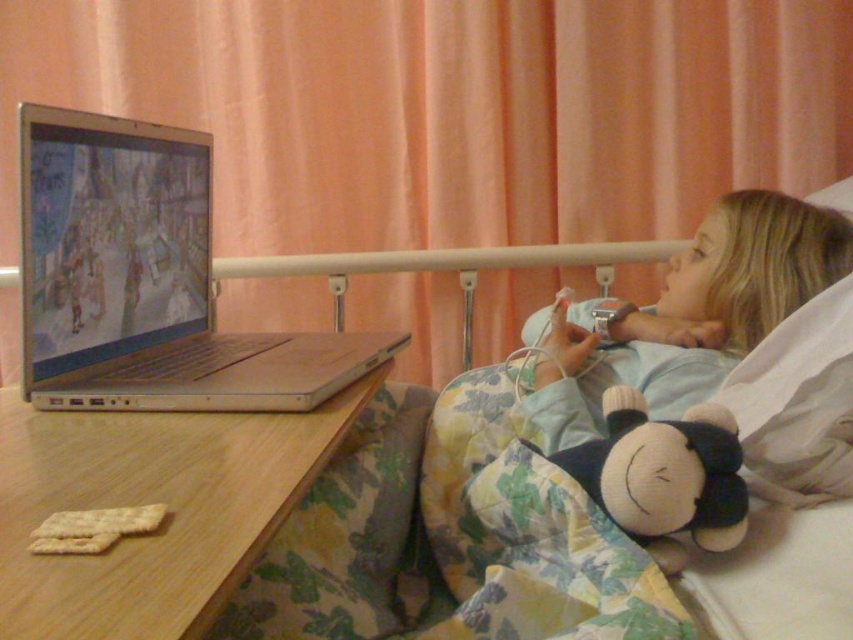
You are a nurse entering the room and need to check the child. The fluffy fabric bed at center is in the way of the door. Can you walk around it to reach the child?

The fluffy fabric bed at center is located at point (450, 536), so yes, you can walk around it to reach the child.

You are a nurse entering the room and need to check the child. To do so, you must approach the bed and the monkey. Which object should you move closer to first, the fluffy fabric bed at center or the soft fabric monkey at lower right?

You should move closer to the fluffy fabric bed at center first because it is closer to you than the soft fabric monkey at lower right.